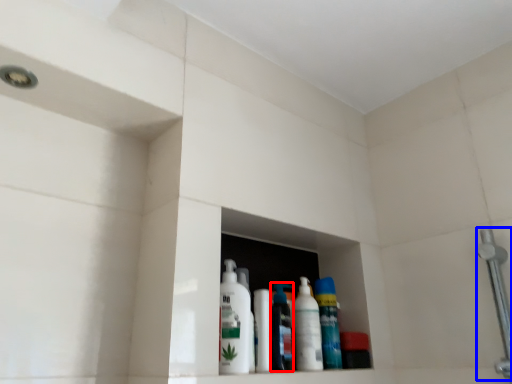
Question: Which object appears closest to the camera in this image, cleaning product (highlighted by a red box) or shower (highlighted by a blue box)?

Choices:
 (A) cleaning product
 (B) shower

Answer: (B)